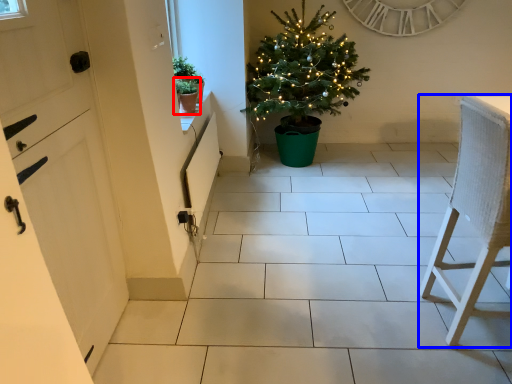
Question: Which of the following is the farthest to the observer, houseplant (highlighted by a red box) or furniture (highlighted by a blue box)?

Choices:
 (A) houseplant
 (B) furniture

Answer: (A)